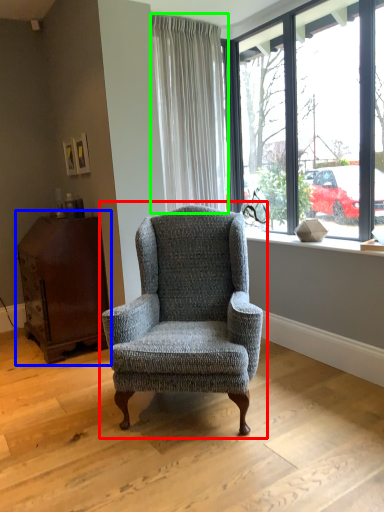
Question: Estimate the real-world distances between objects in this image. Which object is farther from chair (highlighted by a red box), dresser (highlighted by a blue box) or curtain (highlighted by a green box)?

Choices:
 (A) dresser
 (B) curtain

Answer: (B)